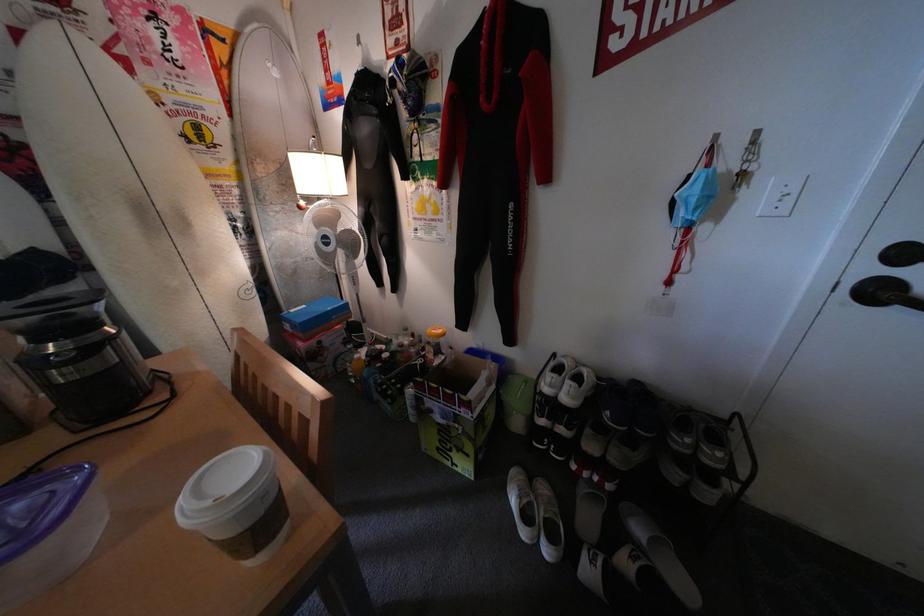
Where would you push the white light switch? Please return your answer as a coordinate pair (x, y).

(787, 201)